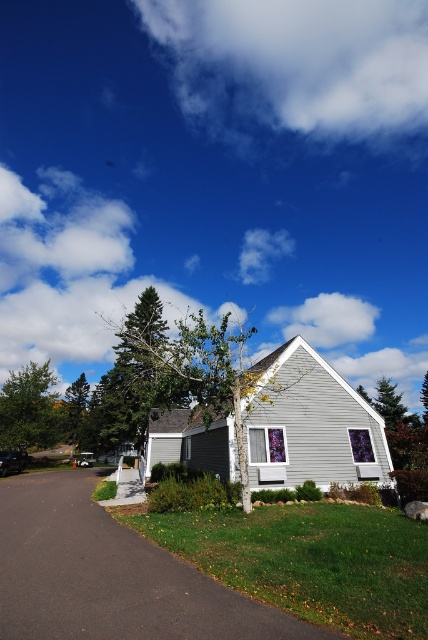
Is dark asphalt driveway at lower left shorter than green leafy tree at center?

Yes, dark asphalt driveway at lower left is shorter than green leafy tree at center.

This screenshot has height=640, width=428. I want to click on dark asphalt driveway at lower left, so click(x=109, y=576).

Does dark asphalt driveway at lower left have a greater width compared to green leafy tree at left?

No.

Can you confirm if dark asphalt driveway at lower left is positioned below green leafy tree at left?

Actually, dark asphalt driveway at lower left is above green leafy tree at left.

Is point (133, 550) positioned before point (14, 372)?

That is True.

Where is `dark asphalt driveway at lower left`? Image resolution: width=428 pixels, height=640 pixels. dark asphalt driveway at lower left is located at coordinates (109, 576).

Where is `green leafy tree at center`? green leafy tree at center is located at coordinates (216, 378).

Is point (213, 374) positioned before point (5, 406)?

Yes, point (213, 374) is closer to viewer.

The width and height of the screenshot is (428, 640). Identify the location of green leafy tree at center. (216, 378).